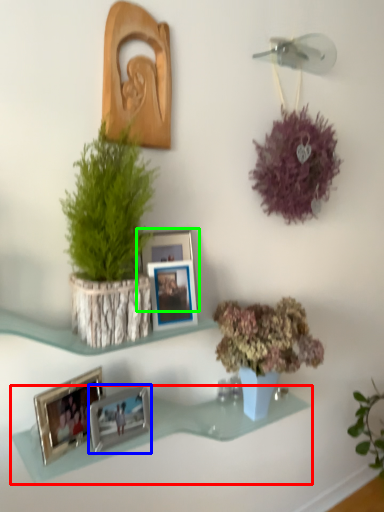
Question: Considering the real-world distances, which object is closest to shelf (highlighted by a red box)? picture frame (highlighted by a blue box) or picture frame (highlighted by a green box).

Choices:
 (A) picture frame
 (B) picture frame

Answer: (A)